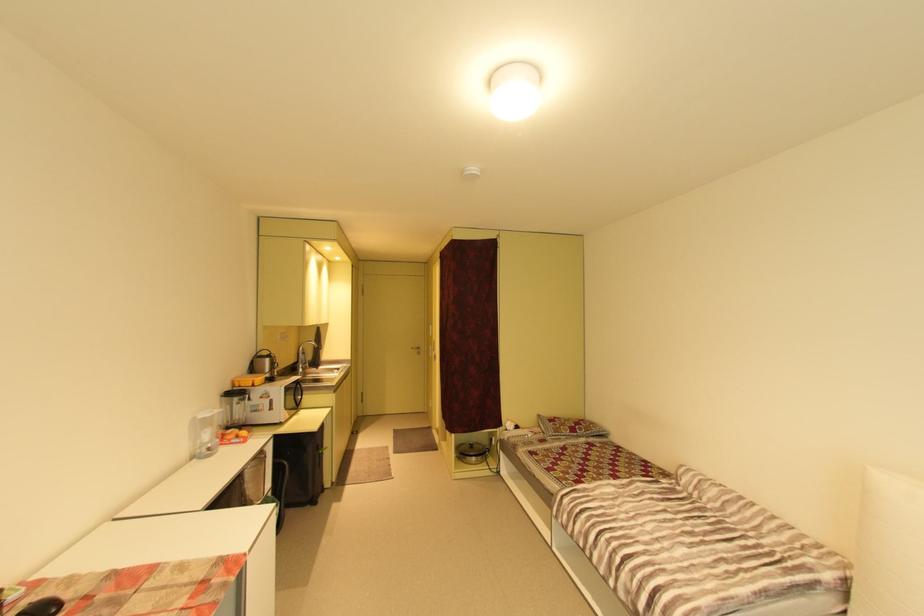
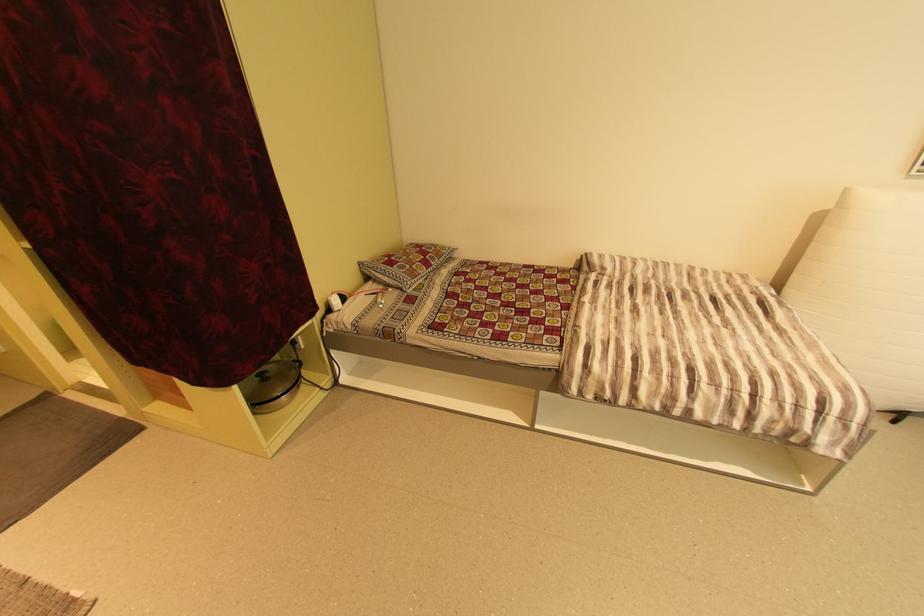
Where in the second image is the point corresponding to pixel 476 446 from the first image?

(265, 379)